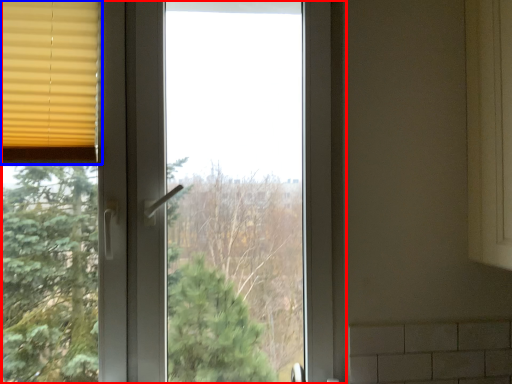
Question: Which point is closer to the camera, window (highlighted by a red box) or window blind (highlighted by a blue box)?

Choices:
 (A) window
 (B) window blind

Answer: (A)